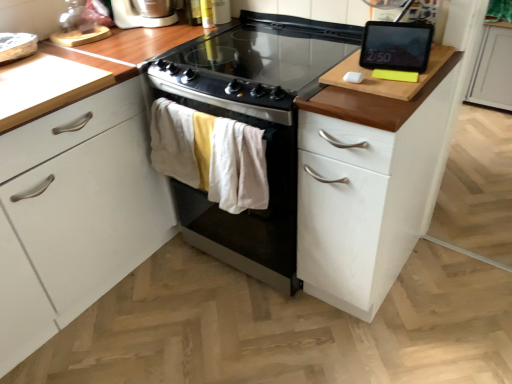
At what (x,y) coordinates should I click in order to perform the action: click on vacant region to the left of white wood cabinet at right. Please return your answer as a coordinate pair (x, y). This screenshot has width=512, height=384. Looking at the image, I should click on (251, 318).